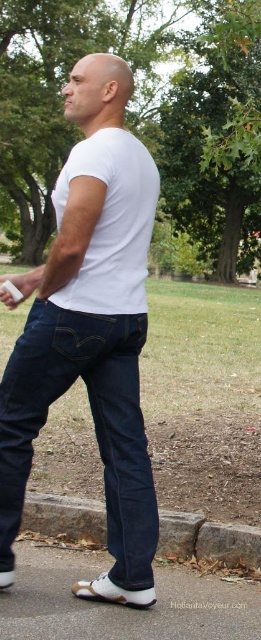
Question: Which point is closer to the camera taking this photo?

Choices:
 (A) (115, 236)
 (B) (60, 516)

Answer: (A)

Question: Which object appears farthest from the camera in this image?

Choices:
 (A) gray concrete curb at lower center
 (B) white matte t-shirt at center

Answer: (A)

Question: From the image, what is the correct spatial relationship of white matte t-shirt at center in relation to gray concrete curb at lower center?

Choices:
 (A) right
 (B) left

Answer: (B)

Question: Can you confirm if white matte t-shirt at center is wider than gray concrete curb at lower center?

Choices:
 (A) yes
 (B) no

Answer: (A)

Question: Which point is closer to the camera?

Choices:
 (A) white matte t-shirt at center
 (B) gray concrete curb at lower center

Answer: (A)

Question: Can you confirm if white matte t-shirt at center is bigger than gray concrete curb at lower center?

Choices:
 (A) yes
 (B) no

Answer: (A)